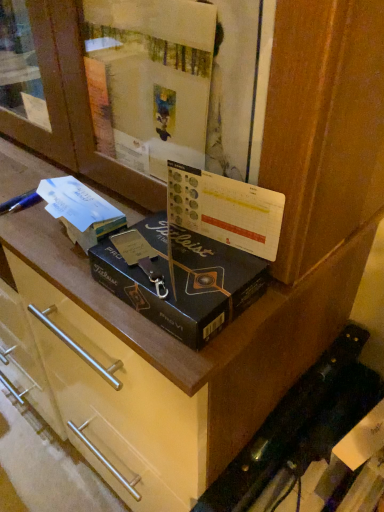
Question: Considering the positions of white paper at upper left and black matte box at center in the image, is white paper at upper left bigger or smaller than black matte box at center?

Choices:
 (A) big
 (B) small

Answer: (B)

Question: In terms of height, does white paper at upper left look taller or shorter compared to black matte box at center?

Choices:
 (A) tall
 (B) short

Answer: (A)

Question: From the image's perspective, relative to black matte box at center, is white paper at upper left above or below?

Choices:
 (A) above
 (B) below

Answer: (A)

Question: Is black matte box at center wider or thinner than white paper at upper left?

Choices:
 (A) wide
 (B) thin

Answer: (A)

Question: Relative to white paper at upper left, is black matte box at center in front or behind?

Choices:
 (A) front
 (B) behind

Answer: (A)

Question: From the image's perspective, relative to white paper at upper left, is black matte box at center above or below?

Choices:
 (A) above
 (B) below

Answer: (B)

Question: Is black matte box at center inside the boundaries of white paper at upper left, or outside?

Choices:
 (A) inside
 (B) outside

Answer: (B)